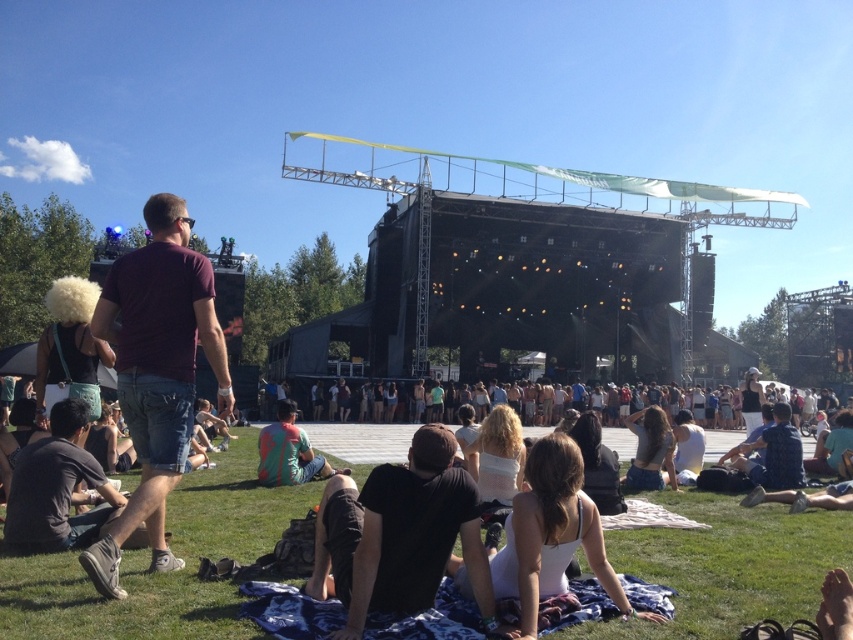
Does white fabric at center have a larger size compared to denim shorts at lower right?

No.

Describe the element at coordinates (550, 536) in the screenshot. Image resolution: width=853 pixels, height=640 pixels. I see `white fabric at center` at that location.

Which is behind, point (560, 554) or point (660, 419)?

The point (660, 419) is more distant.

This screenshot has width=853, height=640. Identify the location of white fabric at center. (550, 536).

Does black cotton shirt at center have a larger size compared to denim shorts at lower right?

No.

Is point (393, 557) farther from viewer compared to point (656, 476)?

No, (393, 557) is in front of (656, 476).

Identify the location of black cotton shirt at center. (402, 534).

This screenshot has height=640, width=853. Identify the location of black cotton shirt at center. (402, 534).

Can you confirm if green grass at lower center is bigger than teal fabric shorts at center?

Correct, green grass at lower center is larger in size than teal fabric shorts at center.

What do you see at coordinates (161, 573) in the screenshot?
I see `green grass at lower center` at bounding box center [161, 573].

Which is behind, point (822, 541) or point (312, 474)?

The point (312, 474) is more distant.

You are a GUI agent. You are given a task and a screenshot of the screen. Output one action in this format:
    pyautogui.click(x=<x>, y=<y>)
    Task: Click on the green grass at lower center
    
    Given the screenshot: What is the action you would take?
    pyautogui.click(x=161, y=573)